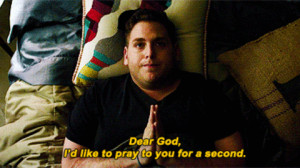
Identify the location of floor. Image resolution: width=300 pixels, height=168 pixels. (4, 83).